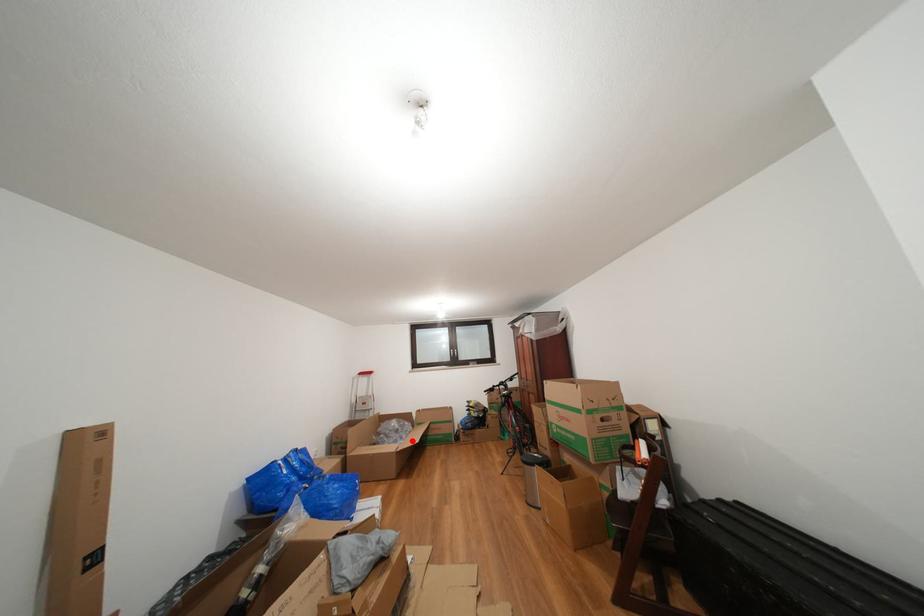
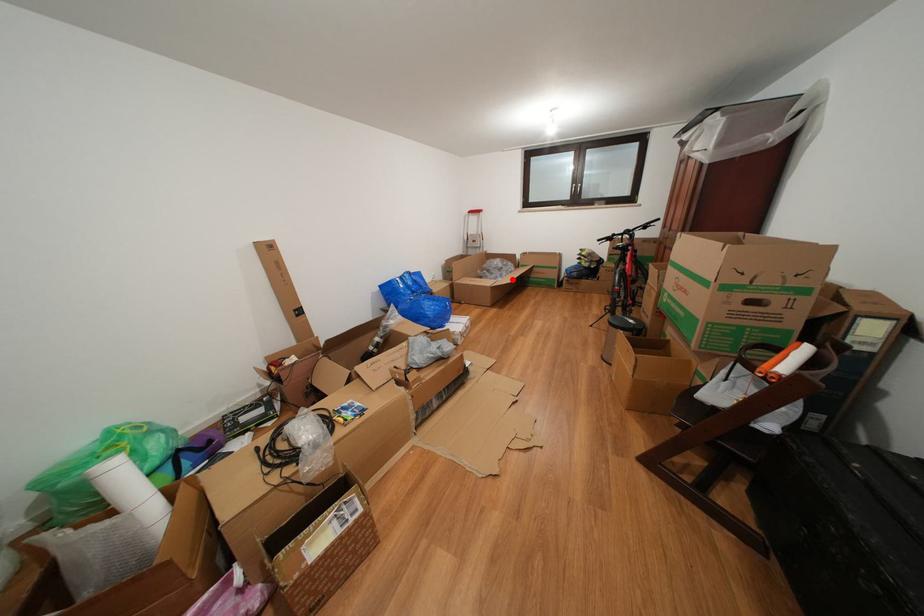
I am providing you with two images of the same scene from different viewpoints. A red point is marked on the first image and another point is marked on the second image. Is the marked point in image1 the same physical position as the marked point in image2?

Yes